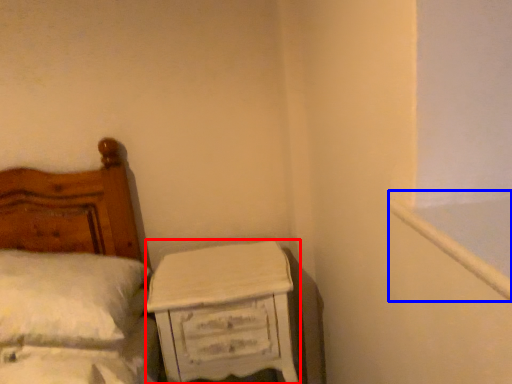
Question: Which of the following is the farthest to the observer, nightstand (highlighted by a red box) or window frame (highlighted by a blue box)?

Choices:
 (A) nightstand
 (B) window frame

Answer: (A)